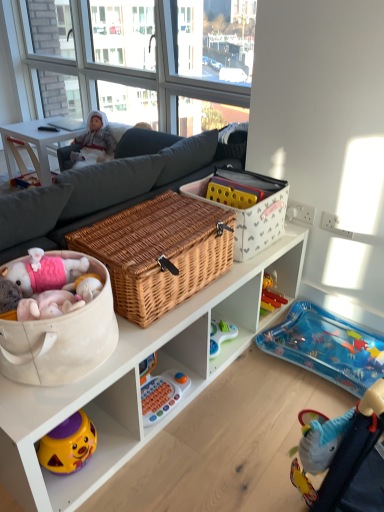
Locate an element on the screen. The width and height of the screenshot is (384, 512). vacant space in front of orange plastic toy at center is located at coordinates [x=159, y=443].